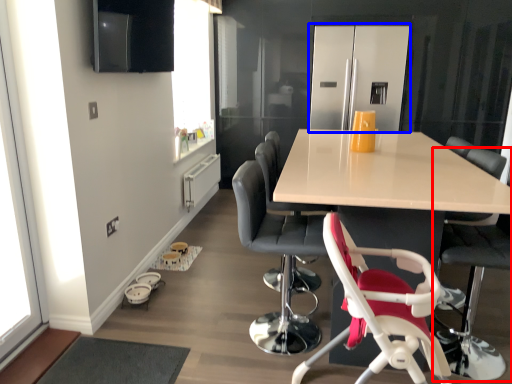
Question: Which of the following is the closest to the observer, chair (highlighted by a red box) or appliance (highlighted by a blue box)?

Choices:
 (A) chair
 (B) appliance

Answer: (A)